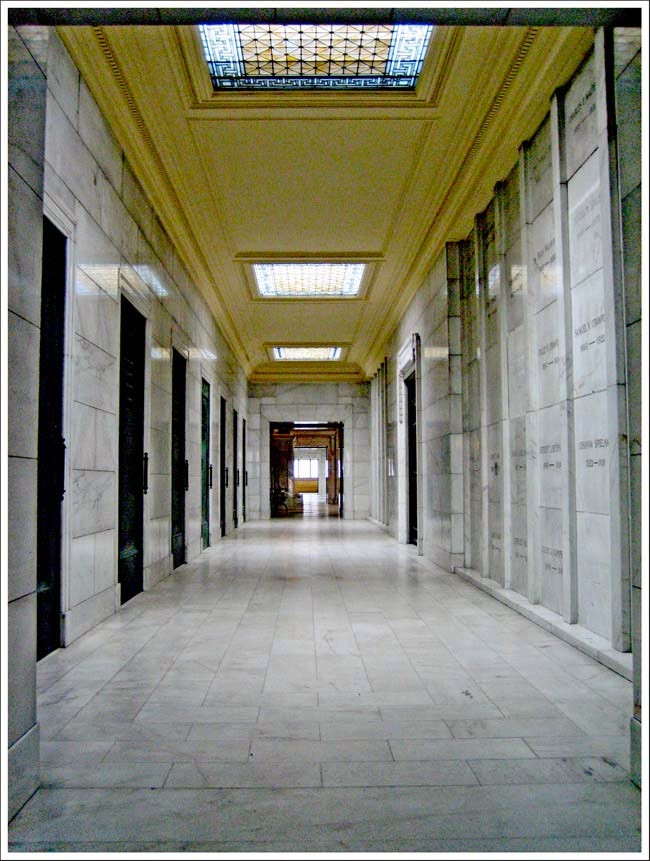
Locate an element on the screen. The image size is (650, 861). pillars is located at coordinates (637, 477), (26, 556).